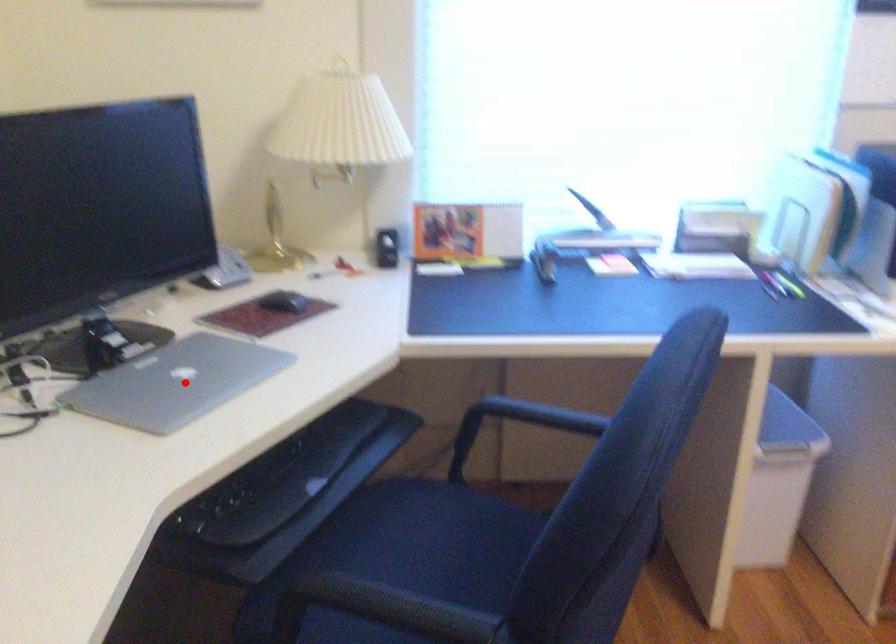
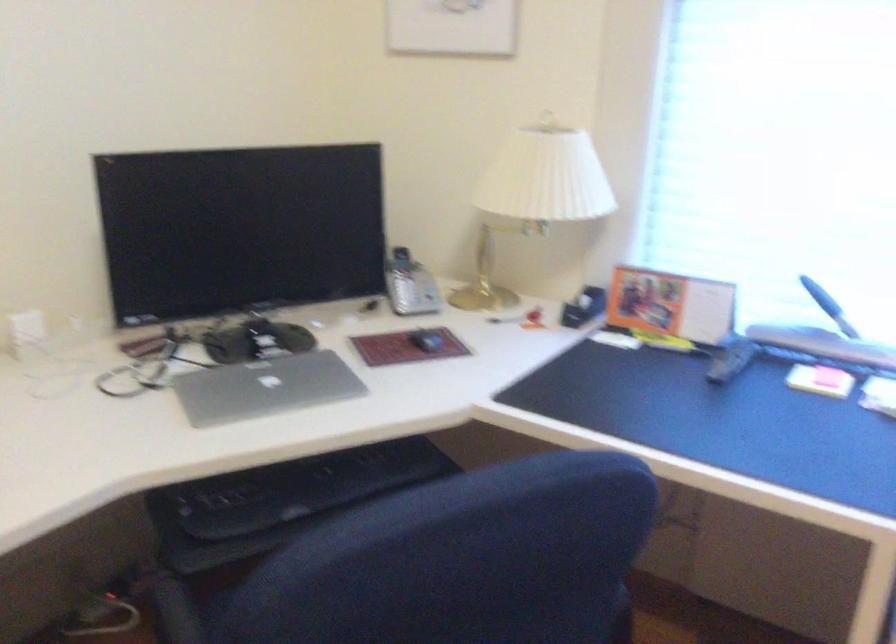
In the second image, find the point that corresponds to the highlighted location in the first image.

(264, 386)